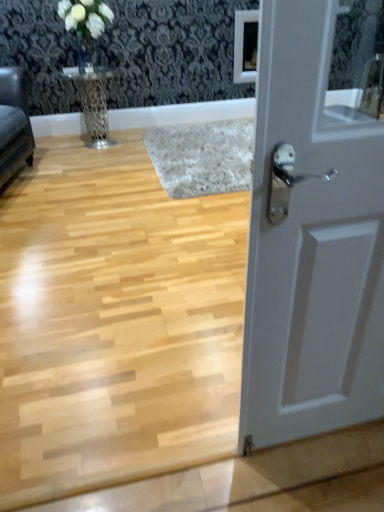
Question: Can you confirm if white matte door at right is positioned to the right of metallic silver table at upper left?

Choices:
 (A) yes
 (B) no

Answer: (A)

Question: Are white matte door at right and metallic silver table at upper left located far from each other?

Choices:
 (A) no
 (B) yes

Answer: (B)

Question: From a real-world perspective, is white matte door at right physically below metallic silver table at upper left?

Choices:
 (A) no
 (B) yes

Answer: (A)

Question: Does white matte door at right come behind metallic silver table at upper left?

Choices:
 (A) no
 (B) yes

Answer: (A)

Question: From a real-world perspective, is white matte door at right physically above metallic silver table at upper left?

Choices:
 (A) no
 (B) yes

Answer: (B)

Question: Considering the relative sizes of white matte door at right and metallic silver table at upper left in the image provided, is white matte door at right smaller than metallic silver table at upper left?

Choices:
 (A) no
 (B) yes

Answer: (B)

Question: Is velvet dark gray sofa at left taller than metallic silver table at upper left?

Choices:
 (A) yes
 (B) no

Answer: (A)

Question: From the image's perspective, is velvet dark gray sofa at left over metallic silver table at upper left?

Choices:
 (A) no
 (B) yes

Answer: (A)

Question: Could you tell me if velvet dark gray sofa at left is facing metallic silver table at upper left?

Choices:
 (A) yes
 (B) no

Answer: (B)

Question: Considering the relative positions of velvet dark gray sofa at left and metallic silver table at upper left in the image provided, is velvet dark gray sofa at left in front of metallic silver table at upper left?

Choices:
 (A) no
 (B) yes

Answer: (B)

Question: Does velvet dark gray sofa at left have a smaller size compared to metallic silver table at upper left?

Choices:
 (A) yes
 (B) no

Answer: (B)

Question: From a real-world perspective, is velvet dark gray sofa at left positioned over metallic silver table at upper left based on gravity?

Choices:
 (A) no
 (B) yes

Answer: (B)

Question: Can you confirm if white matte door at right is bigger than velvet dark gray sofa at left?

Choices:
 (A) no
 (B) yes

Answer: (A)